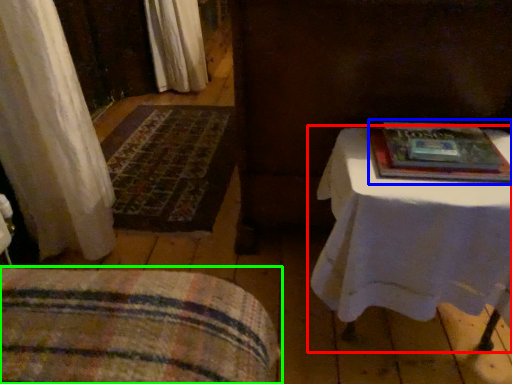
Question: Based on their relative distances, which object is nearer to table (highlighted by a red box)? Choose from paperback book (highlighted by a blue box) and furniture (highlighted by a green box).

Choices:
 (A) paperback book
 (B) furniture

Answer: (A)